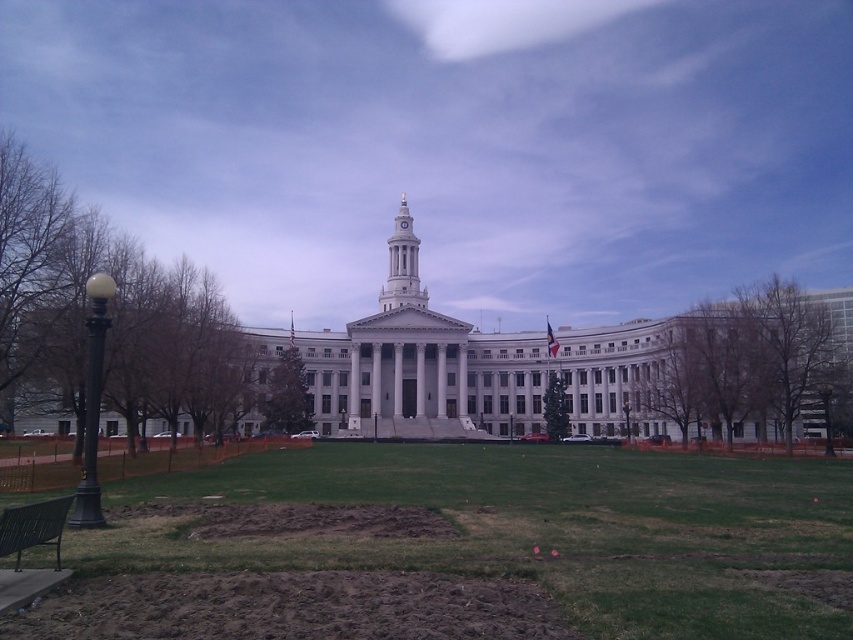
Question: Estimate the real-world distances between objects in this image. Which object is closer to the gold metallic spire at center?

Choices:
 (A) metallic green bench at lower left
 (B) black polished lamp post at left
 (C) green grass at center

Answer: (C)

Question: Can you confirm if metallic green bench at lower left is wider than gold metallic spire at center?

Choices:
 (A) no
 (B) yes

Answer: (B)

Question: Which of these objects is positioned closest to the metallic green bench at lower left?

Choices:
 (A) gold metallic spire at center
 (B) black polished lamp post at left

Answer: (B)

Question: Which of the following is the farthest from the observer?

Choices:
 (A) (38, 516)
 (B) (560, 456)
 (C) (412, 252)

Answer: (C)

Question: Does black polished lamp post at left come in front of gold metallic spire at center?

Choices:
 (A) yes
 (B) no

Answer: (A)

Question: Can you confirm if green grass at center is wider than black polished lamp post at left?

Choices:
 (A) no
 (B) yes

Answer: (B)